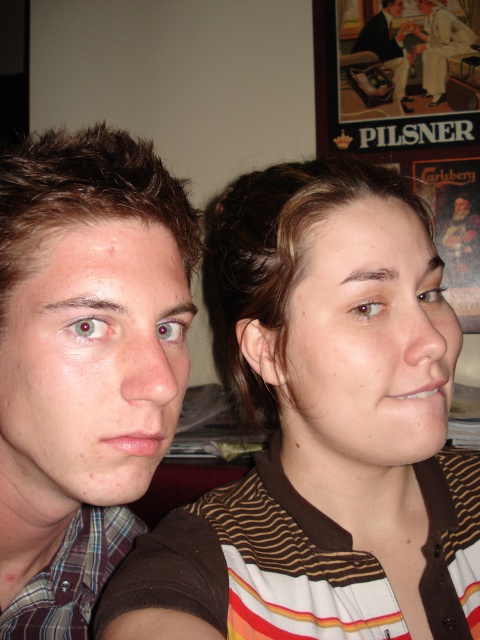
You are a photographer trying to capture a closeup shot of the matte skin face at left and the matte brown hair at center. Since you want to focus on both subjects equally, which one should you adjust the camera focus on more, considering their sizes?

The matte skin face at left is bigger than the matte brown hair at center, so you should focus more on the matte skin face at left to ensure both appear equally sharp in the photo.

Based on the scene description, if you were to look at the image, which object would you see first between the matte paper poster at upper right and the smooth skin face at upper center?

The smooth skin face at upper center is positioned above the matte paper poster at upper right, so you would see the smooth skin face at upper center first when looking at the image.

You are a photographer setting up a shoot in this room. You need to decide where to place a large lamp that is 2 meters tall. Given the space between the matte paper poster at upper right and the light beige suit at upper right, will the lamp fit vertically between them?

The matte paper poster at upper right is much taller than the light beige suit at upper right, so the vertical space between them may not accommodate a 2 meter tall lamp. The poster is taller, but the exact distance isn not specified. Without knowing the actual height difference or spacing between the objects, it is uncertain if the lamp will fit.